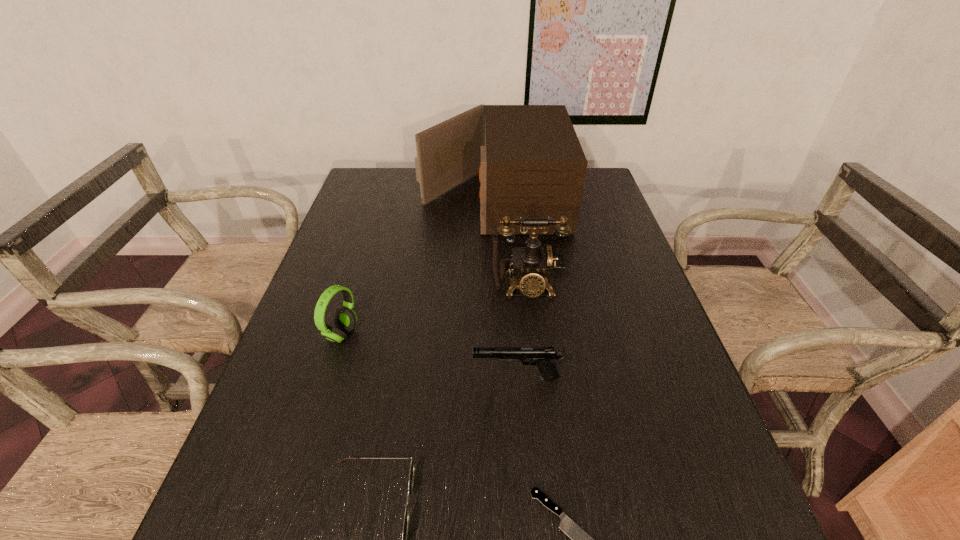
Locate an element on the screen. The width and height of the screenshot is (960, 540). free region at the far right corner of the desktop is located at coordinates (602, 184).

Find the location of a particular element. vacant point located between the gun and the farthest object is located at coordinates (505, 288).

At what (x,y) coordinates should I click in order to perform the action: click on vacant point located between the third nearest object and the fourth nearest object. Please return your answer as a coordinate pair (x, y). The height and width of the screenshot is (540, 960). Looking at the image, I should click on (429, 356).

Point out which object is positioned as the fourth nearest to the fourth tallest object. Please provide its 2D coordinates. Your answer should be formatted as a tuple, i.e. [(x, y)], where the tuple contains the x and y coordinates of a point satisfying the conditions above.

[(345, 319)]

Where is `the fourth closest object to the microwave oven`? The image size is (960, 540). the fourth closest object to the microwave oven is located at coordinates (411, 474).

The height and width of the screenshot is (540, 960). Find the location of `vacant space that satisfies the following two spatial constraints: 1. on the rotary dial of the telephone; 2. at the aiming end of the gun`. vacant space that satisfies the following two spatial constraints: 1. on the rotary dial of the telephone; 2. at the aiming end of the gun is located at coordinates (537, 377).